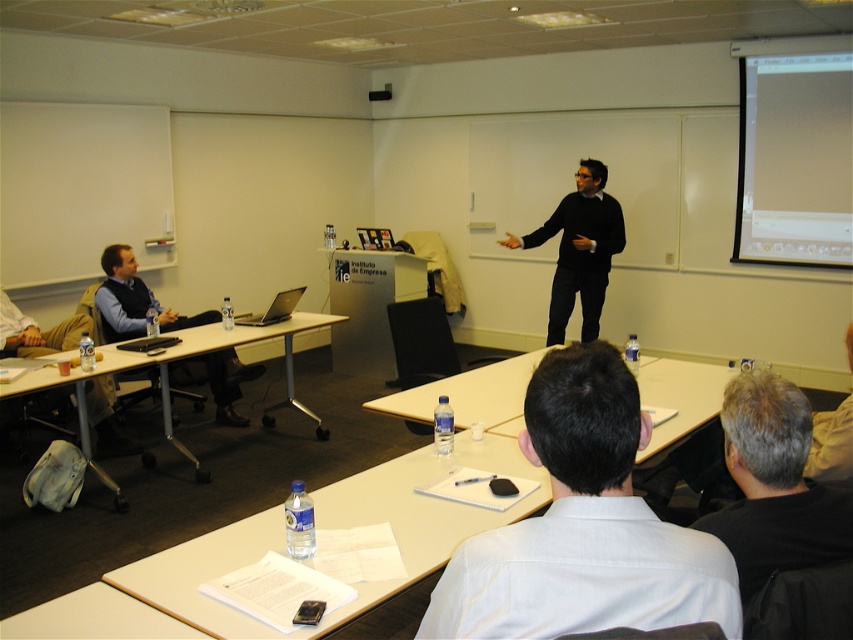
At what (x,y) coordinates should I click in order to perform the action: click on white shirt at center. Please return your answer as a coordinate pair (x, y). Looking at the image, I should click on (583, 525).

Which is more to the right, white shirt at center or matte black vest at left?

Positioned to the right is white shirt at center.

Between point (579, 608) and point (201, 312), which one is positioned in front?

Positioned in front is point (579, 608).

Locate an element on the screen. Image resolution: width=853 pixels, height=640 pixels. white shirt at center is located at coordinates (583, 525).

Is gray hair at back shorter than matte black laptop at left?

No.

Which is above, gray hair at back or matte black laptop at left?

matte black laptop at left is above.

Is point (757, 588) positioned behind point (4, 304)?

No, (757, 588) is in front of (4, 304).

The width and height of the screenshot is (853, 640). What are the coordinates of `gray hair at back` in the screenshot? It's located at (775, 484).

Does point (368, 278) lie in front of point (25, 348)?

That is False.

Does silver metallic table at center have a larger size compared to matte black laptop at left?

Correct, silver metallic table at center is larger in size than matte black laptop at left.

Who is more distant from viewer, [412,282] or [106,404]?

Point [412,282]

Identify the location of silver metallic table at center. The image size is (853, 640). (369, 307).